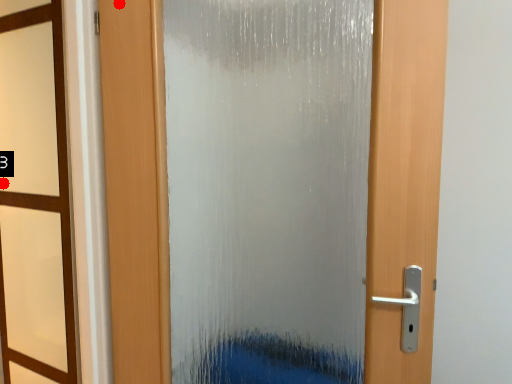
Question: Two points are circled on the image, labeled by A and B beside each circle. Which point is farther to the camera?

Choices:
 (A) A is further
 (B) B is further

Answer: (B)